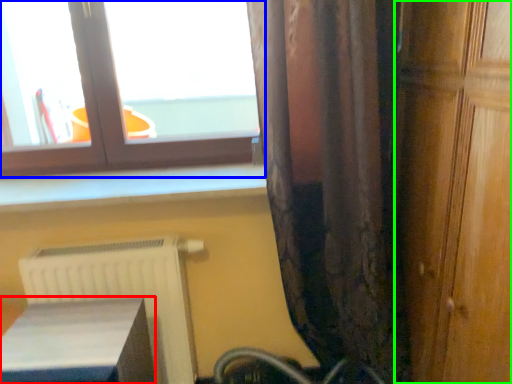
Question: Which is farther away from furniture (highlighted by a red box)? window (highlighted by a blue box) or door (highlighted by a green box)?

Choices:
 (A) window
 (B) door

Answer: (B)